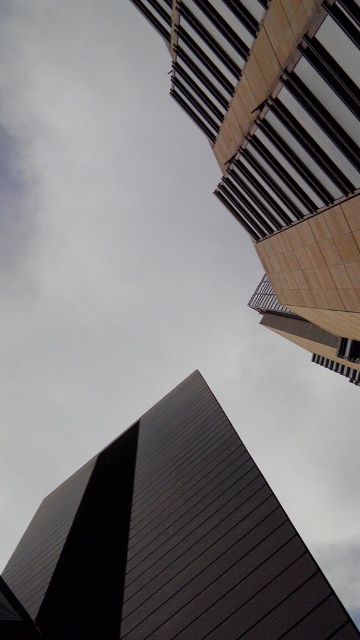
You are an architect analyzing the buildings in this scene. Which building is taller between the dark gray metallic tower at lower center and the smooth beige building at upper right?

The smooth beige building at upper right is taller than the dark gray metallic tower at lower center.

You are standing at the base of the dark gray metallic tower at lower center. Looking up, you notice a maintenance ladder that starts at 0.478 of the tower height. Is the ladder located at the bottom half or the top half of the tower?

The ladder starts at 0.478 of the tower height, which is above the halfway point, so it is located in the top half of the tower.